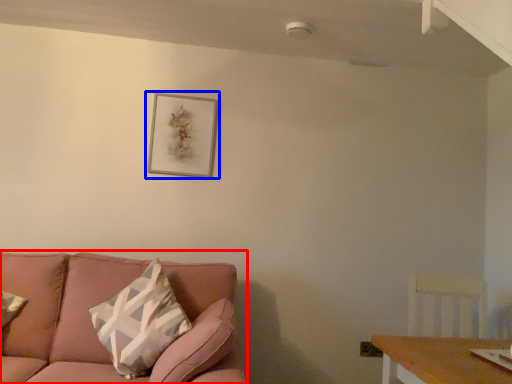
Question: Which object is further to the camera taking this photo, studio couch (highlighted by a red box) or picture frame (highlighted by a blue box)?

Choices:
 (A) studio couch
 (B) picture frame

Answer: (B)